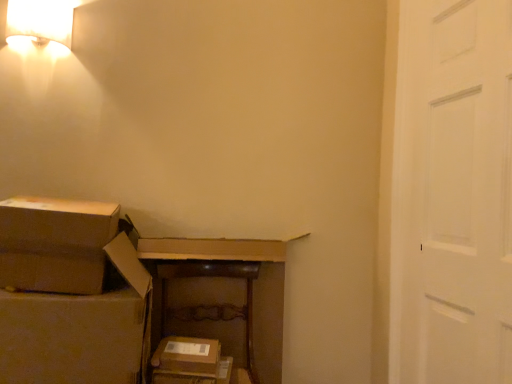
Question: Is brown cardboard box at left, the first storage box from the left, looking in the opposite direction of white painted wood door at right?

Choices:
 (A) no
 (B) yes

Answer: (A)

Question: From the image's perspective, is brown cardboard box at left, the second storage box positioned from the right, on top of white painted wood door at right?

Choices:
 (A) yes
 (B) no

Answer: (B)

Question: Is brown cardboard box at left, the first storage box from the left, at the right side of white painted wood door at right?

Choices:
 (A) yes
 (B) no

Answer: (B)

Question: Does brown cardboard box at left, which is counted as the second storage box, starting from the bottom, have a lesser width compared to white painted wood door at right?

Choices:
 (A) no
 (B) yes

Answer: (A)

Question: Can you confirm if brown cardboard box at left, the second storage box positioned from the right, is taller than white painted wood door at right?

Choices:
 (A) no
 (B) yes

Answer: (A)

Question: Considering the relative positions of brown cardboard box at left, the first storage box from the left, and white painted wood door at right in the image provided, is brown cardboard box at left, the first storage box from the left, to the left of white painted wood door at right from the viewer's perspective?

Choices:
 (A) no
 (B) yes

Answer: (B)

Question: Is brown wooden dresser at center far away from white fabric lampshade at upper left?

Choices:
 (A) no
 (B) yes

Answer: (B)

Question: Is brown wooden dresser at center completely or partially outside of white fabric lampshade at upper left?

Choices:
 (A) yes
 (B) no

Answer: (A)

Question: Can you confirm if brown wooden dresser at center is positioned to the right of white fabric lampshade at upper left?

Choices:
 (A) no
 (B) yes

Answer: (B)

Question: Can white fabric lampshade at upper left be found inside brown wooden dresser at center?

Choices:
 (A) yes
 (B) no

Answer: (B)

Question: From a real-world perspective, is brown wooden dresser at center located higher than white fabric lampshade at upper left?

Choices:
 (A) no
 (B) yes

Answer: (A)

Question: Is brown wooden dresser at center taller than white fabric lampshade at upper left?

Choices:
 (A) yes
 (B) no

Answer: (A)

Question: From the image's perspective, is brown cardboard box at center, the first storage box when ordered from right to left, beneath brown wooden dresser at center?

Choices:
 (A) no
 (B) yes

Answer: (B)